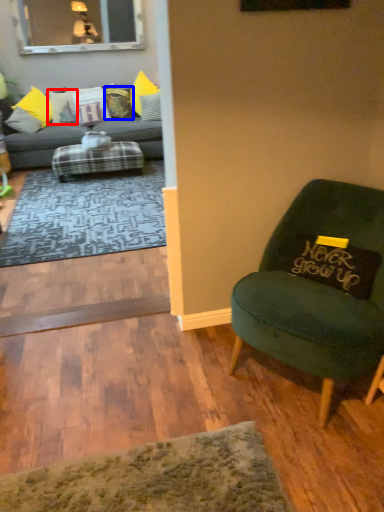
Question: Which point is further to the camera, pillow (highlighted by a red box) or pillow (highlighted by a blue box)?

Choices:
 (A) pillow
 (B) pillow

Answer: (B)